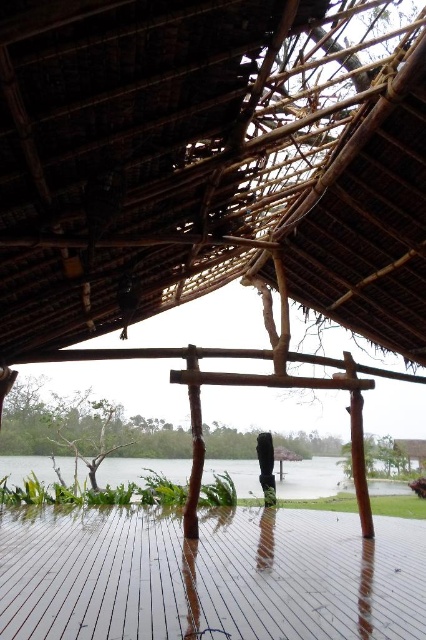
Is brown wooden deck at center positioned at the back of clear water at center?

No.

Is brown wooden deck at center to the left of clear water at center from the viewer's perspective?

Indeed, brown wooden deck at center is positioned on the left side of clear water at center.

Between point (219, 612) and point (291, 490), which one is positioned in front?

Point (219, 612) is more forward.

Find the location of a particular element. The width and height of the screenshot is (426, 640). brown wooden deck at center is located at coordinates point(210,576).

Does brown thatch roof at center appear over brown wooden deck at center?

Yes, brown thatch roof at center is above brown wooden deck at center.

Does brown thatch roof at center have a smaller size compared to brown wooden deck at center?

Incorrect, brown thatch roof at center is not smaller in size than brown wooden deck at center.

Is point (399, 70) in front of point (389, 534)?

Yes, point (399, 70) is in front of point (389, 534).

At what (x,y) coordinates should I click in order to perform the action: click on brown thatch roof at center. Please return your answer as a coordinate pair (x, y). The width and height of the screenshot is (426, 640). Looking at the image, I should click on (210, 161).

Is brown thatch roof at center thinner than clear water at center?

In fact, brown thatch roof at center might be wider than clear water at center.

Does brown thatch roof at center lie behind clear water at center?

No, brown thatch roof at center is closer to the viewer.

The height and width of the screenshot is (640, 426). What do you see at coordinates (210, 161) in the screenshot?
I see `brown thatch roof at center` at bounding box center [210, 161].

Locate an element on the screen. The height and width of the screenshot is (640, 426). brown thatch roof at center is located at coordinates (210, 161).